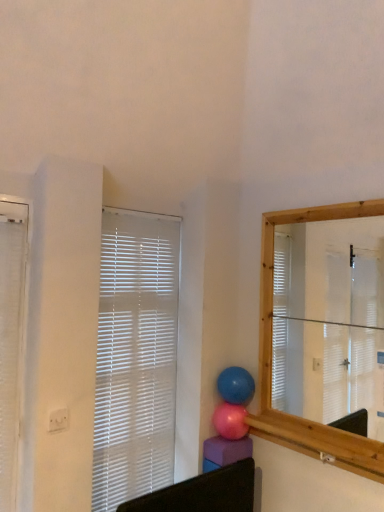
Question: Does glossy blue balloon at center, which ranks as the 2th balloon in bottom-to-top order, have a smaller size compared to white textured window blind at left, which ranks as the second window blind in back-to-front order?

Choices:
 (A) no
 (B) yes

Answer: (B)

Question: Is white textured window blind at left, acting as the second window blind starting from the right, at the back of glossy blue balloon at center, which ranks as the 2th balloon in bottom-to-top order?

Choices:
 (A) no
 (B) yes

Answer: (A)

Question: Can you confirm if glossy blue balloon at center, the first balloon positioned from the top, is positioned to the right of white textured window blind at left, acting as the second window blind starting from the right?

Choices:
 (A) no
 (B) yes

Answer: (B)

Question: Can you confirm if glossy blue balloon at center, the first balloon positioned from the top, is positioned to the left of white textured window blind at left, positioned as the first window blind in left-to-right order?

Choices:
 (A) no
 (B) yes

Answer: (A)

Question: From a real-world perspective, does glossy blue balloon at center, which ranks as the 2th balloon in bottom-to-top order, stand above white textured window blind at left, arranged as the 1th window blind when viewed from the front?

Choices:
 (A) yes
 (B) no

Answer: (B)

Question: Looking at their shapes, would you say pink rubber balloon at center, the second balloon positioned from the top, is wider or thinner than white plastic blinds at upper left, the first window blind from the back?

Choices:
 (A) thin
 (B) wide

Answer: (B)

Question: Is pink rubber balloon at center, the second balloon positioned from the top, to the left or to the right of white plastic blinds at upper left, marked as the 2th window blind in a front-to-back arrangement, in the image?

Choices:
 (A) left
 (B) right

Answer: (B)

Question: Is point click(x=225, y=431) positioned closer to the camera than point click(x=142, y=410)?

Choices:
 (A) farther
 (B) closer

Answer: (B)

Question: From their relative heights in the image, would you say pink rubber balloon at center, the 1th balloon from the bottom, is taller or shorter than white plastic blinds at upper left, which ranks as the first window blind in right-to-left order?

Choices:
 (A) short
 (B) tall

Answer: (A)

Question: In the image, is white textured window blind at left, arranged as the 1th window blind when viewed from the front, on the left side or the right side of glossy blue balloon at center, which ranks as the 2th balloon in bottom-to-top order?

Choices:
 (A) left
 (B) right

Answer: (A)

Question: Does point (21, 323) appear closer or farther from the camera than point (248, 391)?

Choices:
 (A) closer
 (B) farther

Answer: (A)

Question: Do you think white textured window blind at left, which ranks as the second window blind in back-to-front order, is within glossy blue balloon at center, which ranks as the 2th balloon in bottom-to-top order, or outside of it?

Choices:
 (A) inside
 (B) outside

Answer: (B)

Question: From a real-world perspective, relative to glossy blue balloon at center, which ranks as the 2th balloon in bottom-to-top order, is white textured window blind at left, positioned as the first window blind in left-to-right order, vertically above or below?

Choices:
 (A) above
 (B) below

Answer: (A)

Question: From a real-world perspective, is glossy blue balloon at center, the first balloon positioned from the top, physically located above or below pink rubber balloon at center, the 1th balloon from the bottom?

Choices:
 (A) above
 (B) below

Answer: (A)

Question: Is glossy blue balloon at center, the first balloon positioned from the top, wider or thinner than pink rubber balloon at center, the 1th balloon from the bottom?

Choices:
 (A) wide
 (B) thin

Answer: (B)